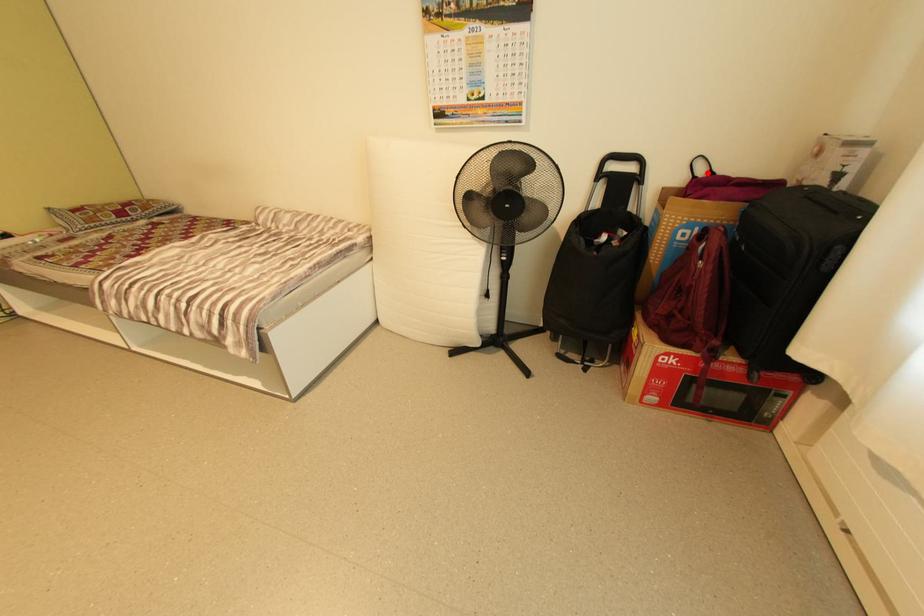
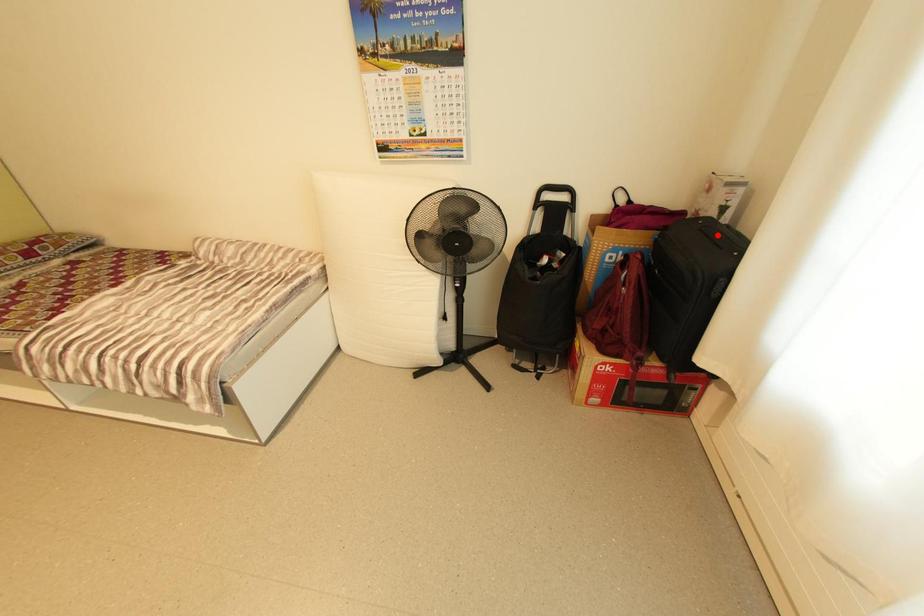
I am providing you with two images of the same scene from different viewpoints. A red point is marked on the first image and another point is marked on the second image. Do the highlighted points in image1 and image2 indicate the same real-world spot?

No